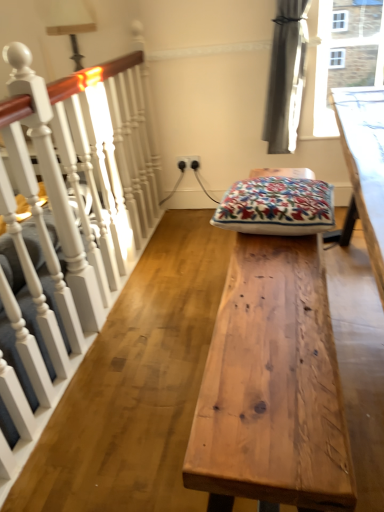
Describe the element at coordinates (277, 206) in the screenshot. I see `embroidered cotton cushion at center` at that location.

The height and width of the screenshot is (512, 384). Describe the element at coordinates (272, 386) in the screenshot. I see `natural wood table at center` at that location.

You are a GUI agent. You are given a task and a screenshot of the screen. Output one action in this format:
    pyautogui.click(x=<x>, y=<y>)
    Task: Click on the embroidered cotton cushion at center
    
    Given the screenshot: What is the action you would take?
    pyautogui.click(x=277, y=206)

Is white painted wood at left oriented towards natural wood table at center?

Yes, white painted wood at left is turned towards natural wood table at center.

From the image's perspective, is white painted wood at left positioned above or below natural wood table at center?

white painted wood at left is above natural wood table at center.

How many degrees apart are the facing directions of white painted wood at left and natural wood table at center?

0.889 degrees.

Locate an element on the screen. The width and height of the screenshot is (384, 512). table on the right of white painted wood at left is located at coordinates (272, 386).

Considering their positions, is natural wood table at center located in front of or behind embroidered cotton cushion at center?

natural wood table at center is positioned closer to the viewer than embroidered cotton cushion at center.

Does point (304, 447) come behind point (294, 192)?

No, (304, 447) is closer to viewer.

Is there a large distance between embroidered cotton cushion at center and natural wood table at center?

They are positioned close to each other.

Does point (292, 214) appear closer or farther from the camera than point (318, 255)?

Point (292, 214) appears to be farther away from the viewer than point (318, 255).

In the scene shown: Could natural wood table at center be considered to be inside embroidered cotton cushion at center?

No.

Can you tell me how much embroidered cotton cushion at center and natural wood table at center differ in facing direction?

There is a 175-degree angle between the facing directions of embroidered cotton cushion at center and natural wood table at center.

Considering the sizes of objects natural wood table at center and white painted wood at left in the image provided, who is bigger, natural wood table at center or white painted wood at left?

white painted wood at left.

From a real-world perspective, between natural wood table at center and white painted wood at left, who is vertically lower?

natural wood table at center, from a real-world perspective.

Is natural wood table at center inside the boundaries of white painted wood at left, or outside?

natural wood table at center is not inside white painted wood at left, it's outside.

Which of these two, natural wood table at center or white painted wood at left, is thinner?

white painted wood at left is thinner.

From a real-world perspective, does embroidered cotton cushion at center sit lower than white painted wood at left?

Actually, embroidered cotton cushion at center is physically above white painted wood at left in the real world.

Is embroidered cotton cushion at center positioned beyond the bounds of white painted wood at left?

Yes, embroidered cotton cushion at center is not within white painted wood at left.

What are the coordinates of `blanket positioned vertically above the white painted wood at left (from a real-world perspective)` in the screenshot? It's located at (277, 206).

Does white painted wood at left have a greater width compared to embroidered cotton cushion at center?

Incorrect, the width of white painted wood at left does not surpass that of embroidered cotton cushion at center.

How much distance is there between white painted wood at left and embroidered cotton cushion at center?

white painted wood at left is 28.69 inches away from embroidered cotton cushion at center.

Would you say embroidered cotton cushion at center is part of white painted wood at left's contents?

No, embroidered cotton cushion at center is located outside of white painted wood at left.

From the image's perspective, is white painted wood at left under embroidered cotton cushion at center?

Actually, white painted wood at left appears above embroidered cotton cushion at center in the image.

This screenshot has width=384, height=512. Find the location of `rail in front of the natural wood table at center`. rail in front of the natural wood table at center is located at coordinates (63, 234).

Where is `blanket that appears behind the natural wood table at center`? This screenshot has height=512, width=384. blanket that appears behind the natural wood table at center is located at coordinates (277, 206).

When comparing their distances from embroidered cotton cushion at center, does white painted wood at left or natural wood table at center seem closer?

Among the two, natural wood table at center is located nearer to embroidered cotton cushion at center.

Looking at the image, which one is located closer to white painted wood at left, embroidered cotton cushion at center or natural wood table at center?

The object closer to white painted wood at left is embroidered cotton cushion at center.

Estimate the real-world distances between objects in this image. Which object is further from natural wood table at center, white painted wood at left or embroidered cotton cushion at center?

white painted wood at left is further to natural wood table at center.

Which object lies nearer to the anchor point white painted wood at left, natural wood table at center or embroidered cotton cushion at center?

Based on the image, embroidered cotton cushion at center appears to be nearer to white painted wood at left.

Looking at the image, which one is located closer to natural wood table at center, embroidered cotton cushion at center or white painted wood at left?

embroidered cotton cushion at center is closer to natural wood table at center.

Based on their spatial positions, is natural wood table at center or white painted wood at left further from embroidered cotton cushion at center?

Based on the image, white painted wood at left appears to be further to embroidered cotton cushion at center.

Identify the location of table located between white painted wood at left and embroidered cotton cushion at center in the left-right direction. (272, 386).